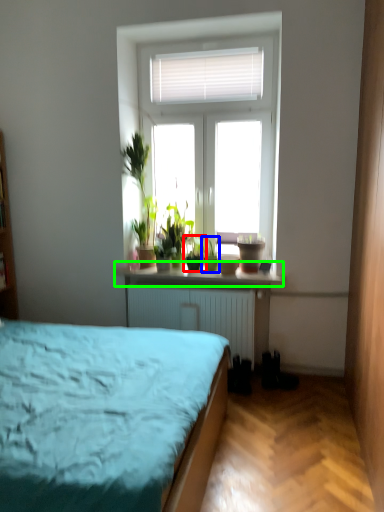
Question: Which object is the closest to the houseplant (highlighted by a red box)? Choose among these: houseplant (highlighted by a blue box) or window sill (highlighted by a green box).

Choices:
 (A) houseplant
 (B) window sill

Answer: (A)